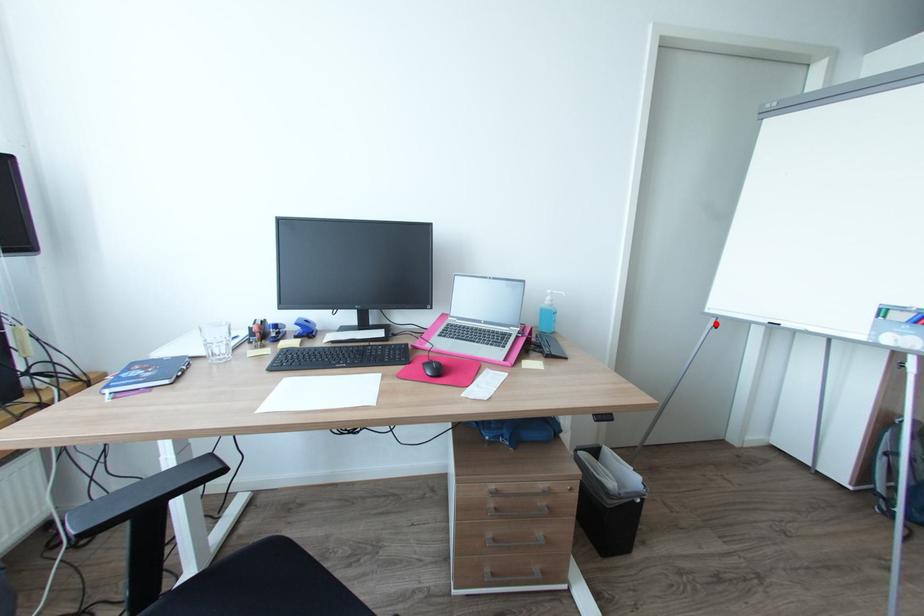
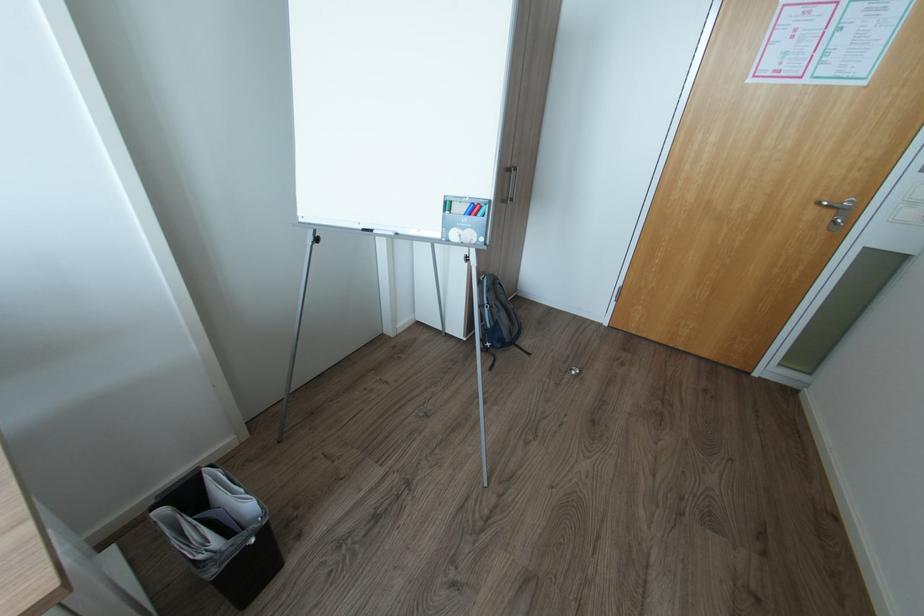
The point at the highlighted location is marked in the first image. Where is the corresponding point in the second image?

(315, 238)